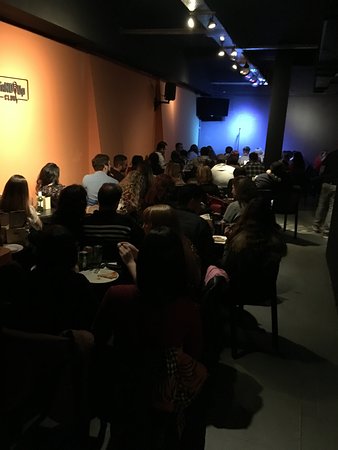
You are a GUI agent. You are given a task and a screenshot of the screen. Output one action in this format:
    pyautogui.click(x=<x>, y=<y>)
    Task: Click on the speaker
    The height and width of the screenshot is (450, 338).
    Given the screenshot: What is the action you would take?
    pyautogui.click(x=209, y=106)